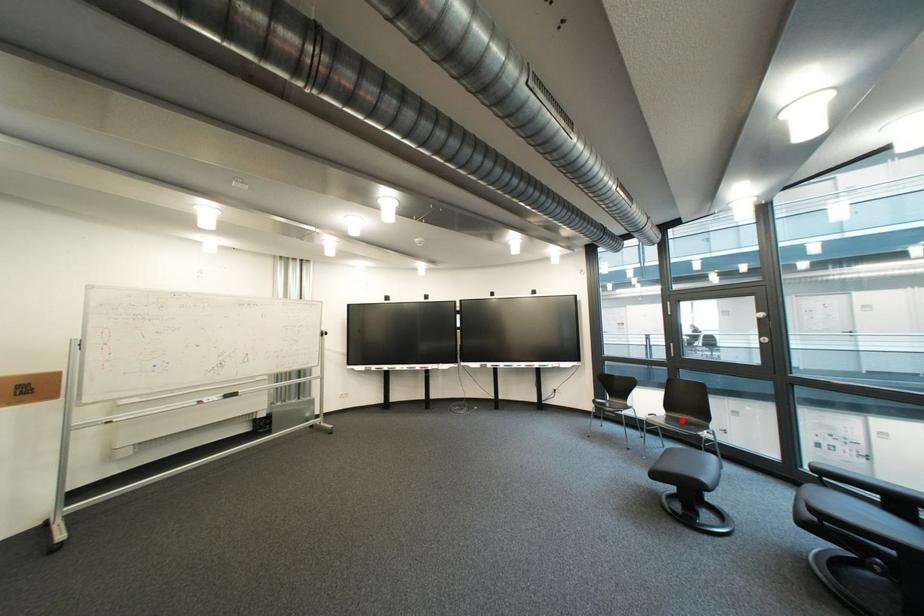
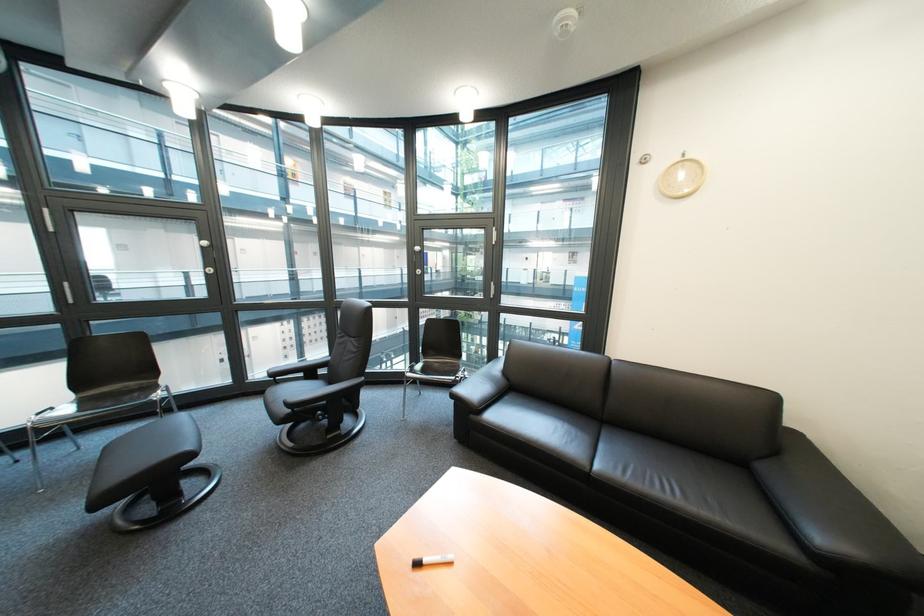
Find the pixel in the second image that matches the highlighted location in the first image.

(98, 403)